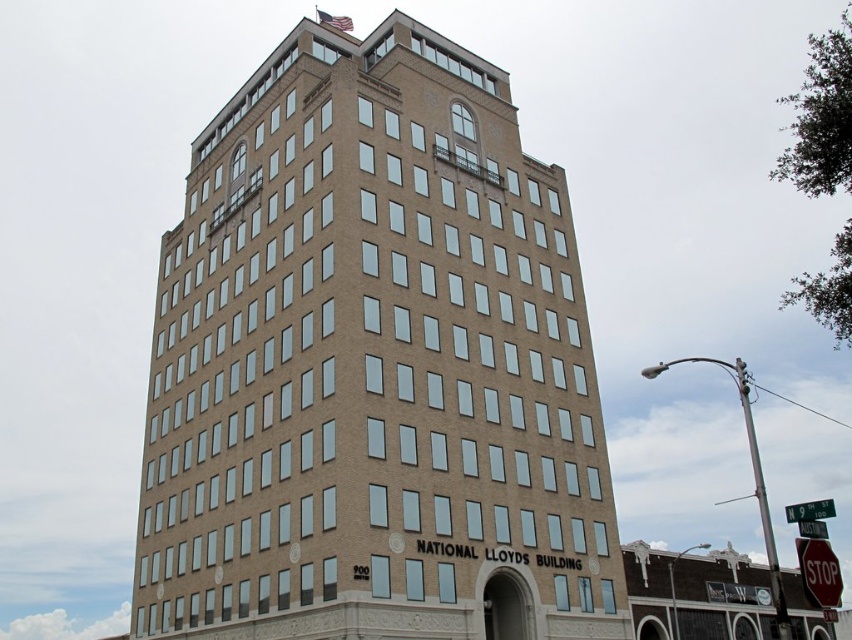
Who is more forward, (x=396, y=125) or (x=636, y=563)?

Point (x=396, y=125) is more forward.

Does brown brick building at center lie behind red brick hotel at lower right?

No.

Does point (484, 301) come farther from viewer compared to point (756, 605)?

No, it is not.

The height and width of the screenshot is (640, 852). Find the location of `brown brick building at center`. brown brick building at center is located at coordinates (373, 365).